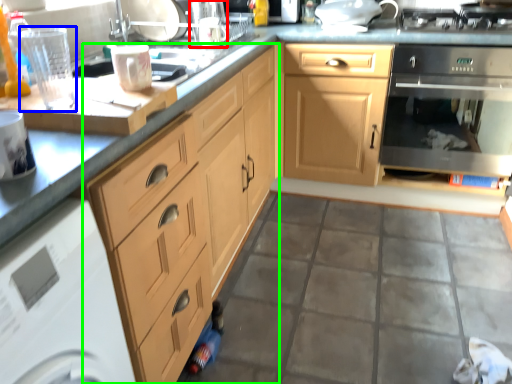
Question: Estimate the real-world distances between objects in this image. Which object is farther from appliance (highlighted by a red box), appliance (highlighted by a blue box) or cabinetry (highlighted by a green box)?

Choices:
 (A) appliance
 (B) cabinetry

Answer: (A)